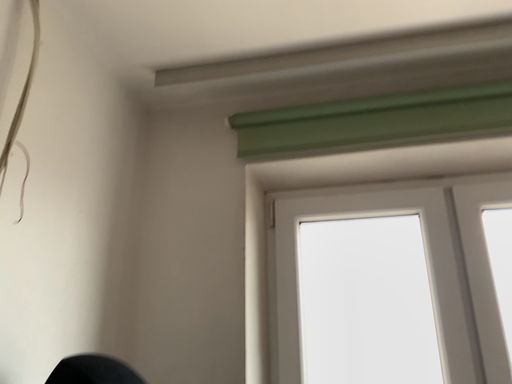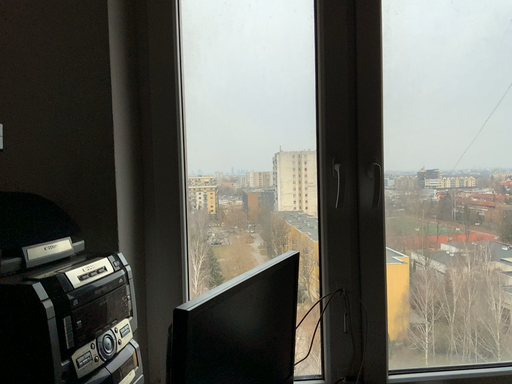
Question: How did the camera likely rotate when shooting the video?

Choices:
 (A) rotated upward
 (B) rotated downward

Answer: (B)